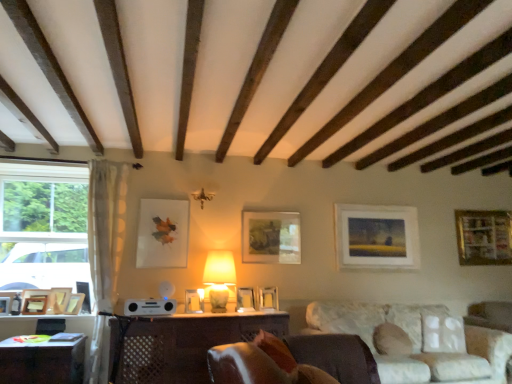
Locate an element on the screen. free space in front of wooden picture frame at lower left, the 11th picture frame viewed from the right is located at coordinates (21, 319).